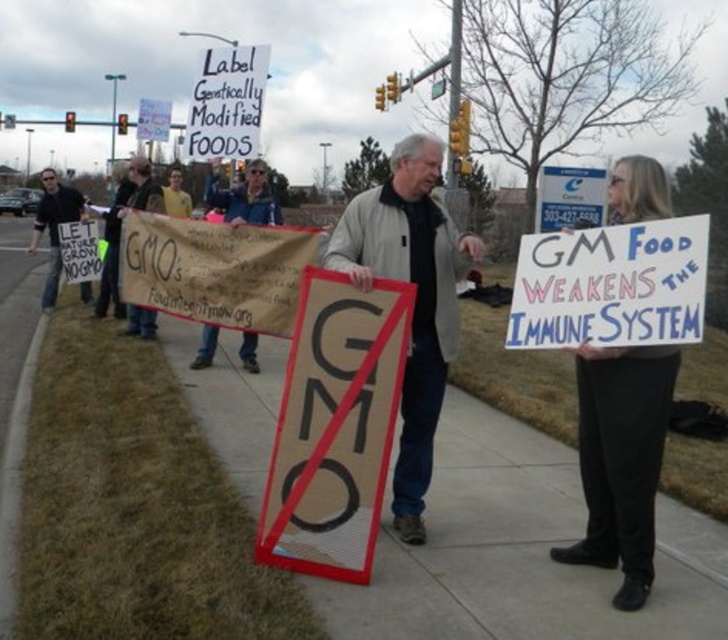
Question: Among these points, which one is farthest from the camera?

Choices:
 (A) (432, 83)
 (B) (266, 328)
 (C) (175, 333)
 (D) (625, 237)

Answer: (A)

Question: Which of the following is the closest to the observer?

Choices:
 (A) (601, 244)
 (B) (162, 200)
 (C) (173, 394)

Answer: (A)

Question: Is handwritten cardboard sign at center further to camera compared to brown cardboard sign at center?

Choices:
 (A) no
 (B) yes

Answer: (A)

Question: Where is black cardboard sign at center located in relation to metallic street sign at upper center in the image?

Choices:
 (A) right
 (B) left

Answer: (B)

Question: Is brown cardboard sign at center bigger than matte black sign at left?

Choices:
 (A) no
 (B) yes

Answer: (A)

Question: Which is farther from the concrete sidewalk at center?

Choices:
 (A) white paper sign at upper center
 (B) metallic street sign at upper center

Answer: (B)